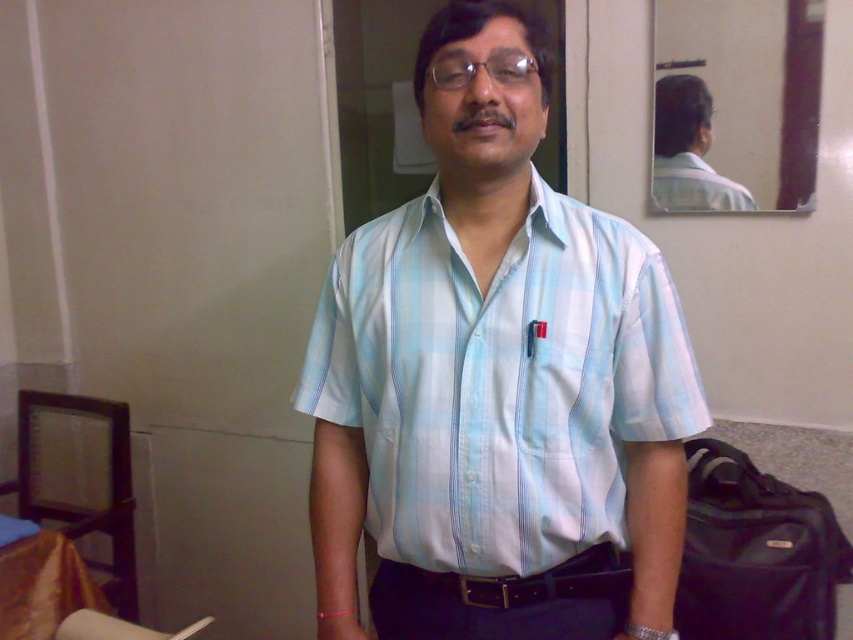
The man in the image is wearing a light blue plaid shirt at center and clear plastic glasses at center. Which item is positioned higher on his body?

The light blue plaid shirt at center is much taller as clear plastic glasses at center, so the light blue plaid shirt at center is positioned higher on his body.

Based on the photo, based on the scene description, where is the clear plastic glasses at center located in relation to the light blue plaid shirt at upper center?

The clear plastic glasses at center are below the light blue plaid shirt at upper center because the light blue plaid shirt at upper center is above them.